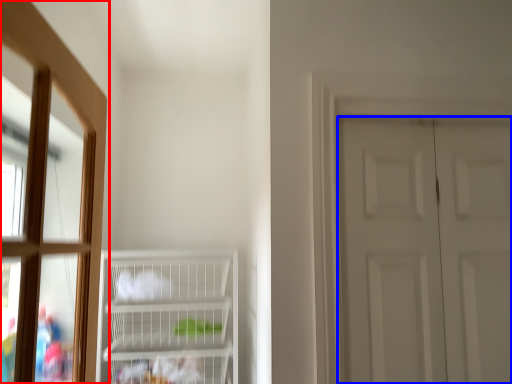
Question: Which of the following is the closest to the observer, window (highlighted by a red box) or door (highlighted by a blue box)?

Choices:
 (A) window
 (B) door

Answer: (A)